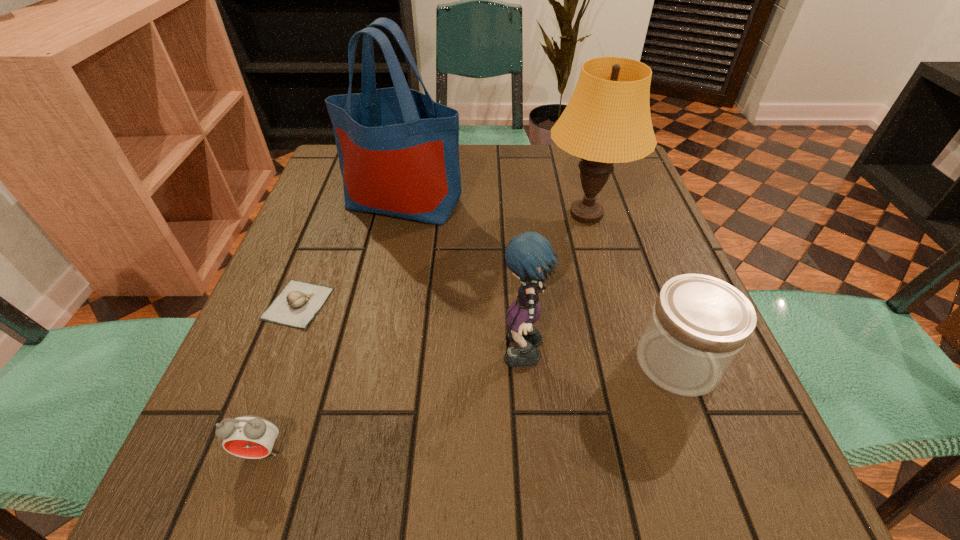
Locate an element on the screen. garlic that is at the left edge is located at coordinates (298, 303).

The image size is (960, 540). In order to click on lampshade that is at the right edge in this screenshot , I will do `click(607, 120)`.

Locate an element on the screen. jar at the right edge is located at coordinates 699,324.

Where is `object that is at the far left corner`? object that is at the far left corner is located at coordinates 398,150.

At what (x,y) coordinates should I click in order to perform the action: click on object that is positioned at the near left corner. Please return your answer as a coordinate pair (x, y). Looking at the image, I should click on (247, 436).

The height and width of the screenshot is (540, 960). I want to click on object present at the far right corner, so click(x=607, y=120).

In the image, there is a desktop. Where is `free region at the left edge`? This screenshot has height=540, width=960. free region at the left edge is located at coordinates click(275, 414).

Locate an element on the screen. This screenshot has width=960, height=540. blank space at the right edge of the desktop is located at coordinates (660, 433).

Locate an element on the screen. The image size is (960, 540). vacant space at the far left corner of the desktop is located at coordinates point(332,174).

This screenshot has width=960, height=540. In order to click on free space at the far right corner of the desktop in this screenshot , I will do `click(577, 156)`.